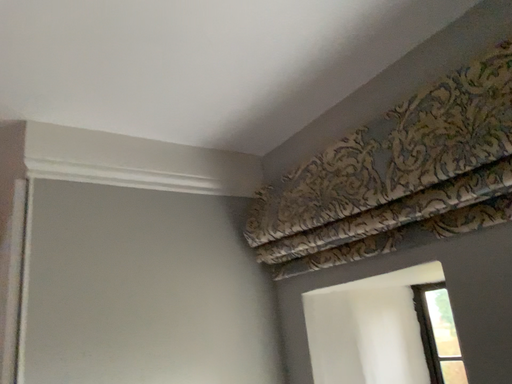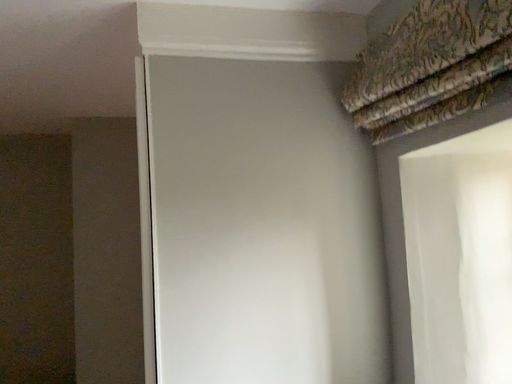
Question: How did the camera likely rotate when shooting the video?

Choices:
 (A) rotated upward
 (B) rotated downward

Answer: (B)